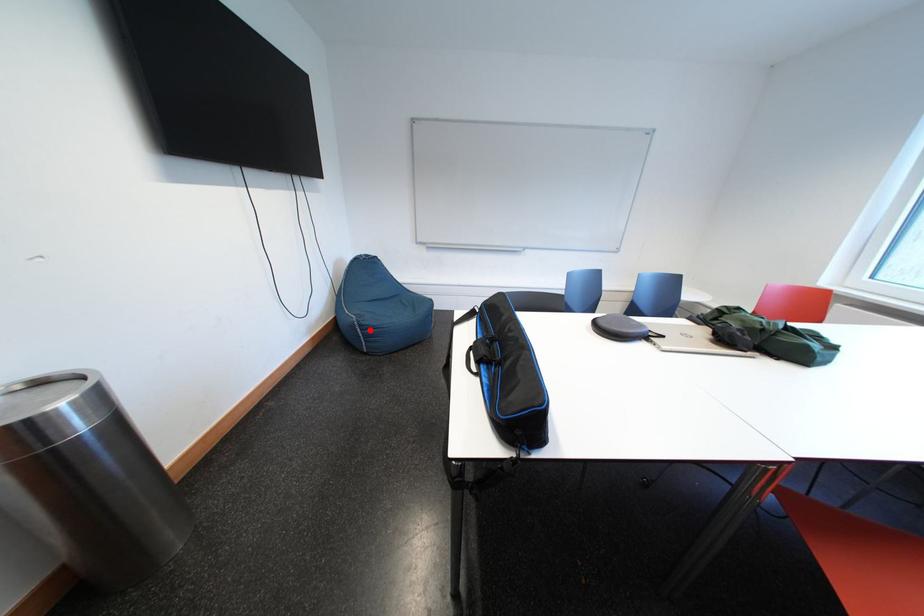
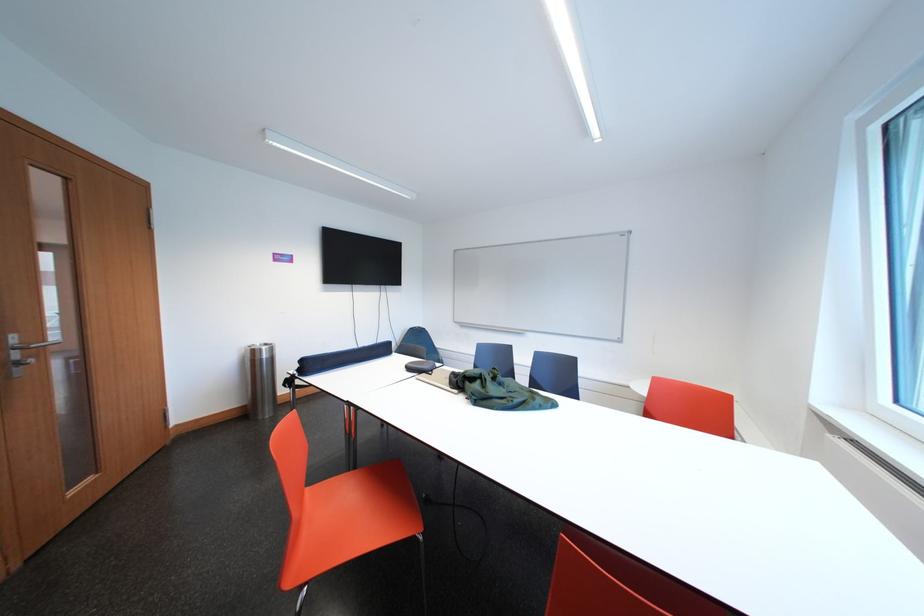
Question: I am providing you with two images of the same scene from different viewpoints. A red point is marked on the first image. At the location where the point appears in image 1, is it still visible in image 2?

Choices:
 (A) Yes
 (B) No

Answer: (B)